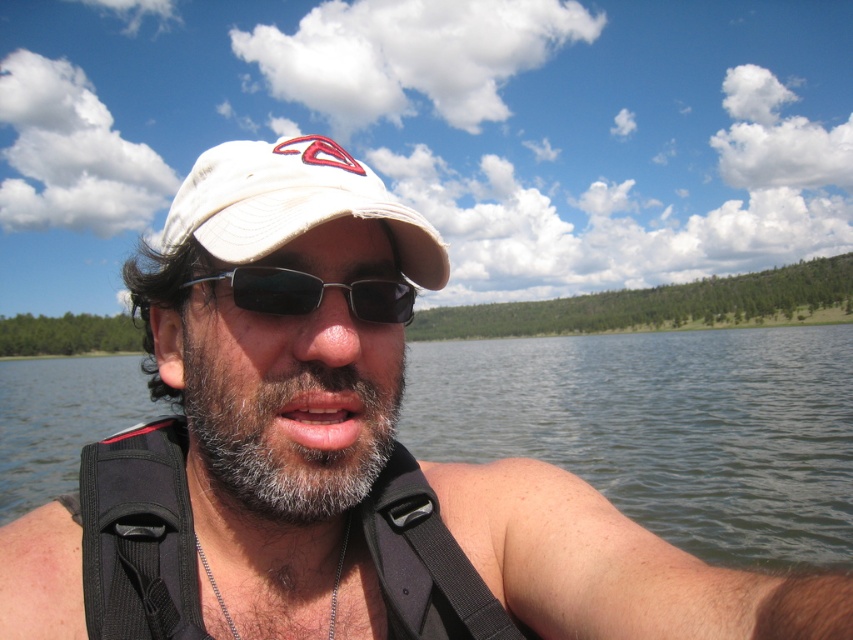
Does clear water at center appear on the left side of black plastic sunglasses at center?

Correct, you'll find clear water at center to the left of black plastic sunglasses at center.

Can you confirm if clear water at center is bigger than black plastic sunglasses at center?

Yes, clear water at center is bigger than black plastic sunglasses at center.

Consider the image. Who is more forward, (x=712, y=540) or (x=216, y=276)?

Point (x=216, y=276) is in front.

I want to click on clear water at center, so point(663,428).

Is white fabric cap at center to the left of black fabric strap at lower center from the viewer's perspective?

Yes, white fabric cap at center is to the left of black fabric strap at lower center.

Which is more to the right, white fabric cap at center or black fabric strap at lower center?

black fabric strap at lower center is more to the right.

Who is more forward, (448,268) or (407,572)?

Point (407,572) is more forward.

Where is `white fabric cap at center`? white fabric cap at center is located at coordinates (292, 204).

Is clear water at center thinner than black fabric strap at lower center?

Incorrect, clear water at center's width is not less than black fabric strap at lower center's.

Which is in front, point (62, 392) or point (448, 593)?

Positioned in front is point (448, 593).

Identify the location of clear water at center. (663, 428).

Image resolution: width=853 pixels, height=640 pixels. Find the location of `clear water at center`. clear water at center is located at coordinates (663, 428).